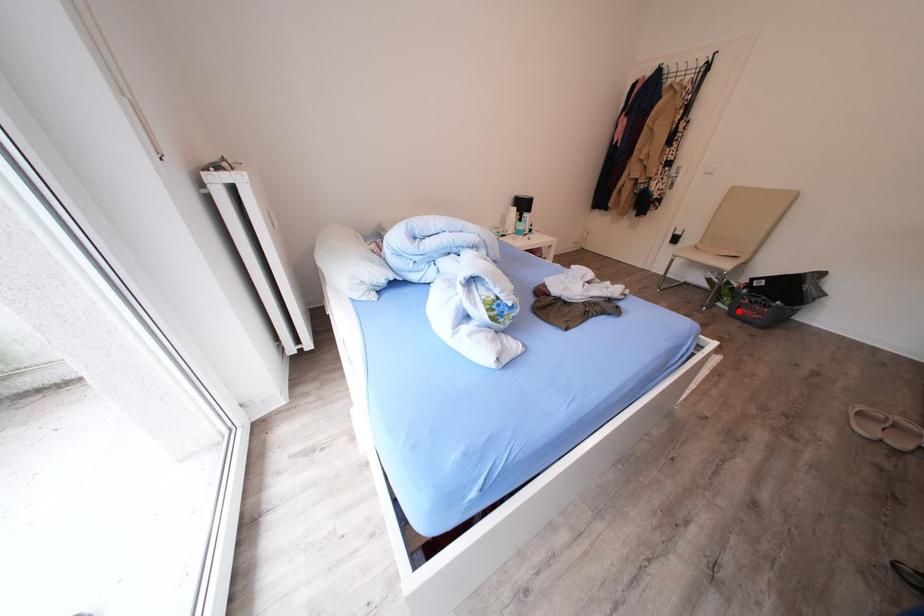
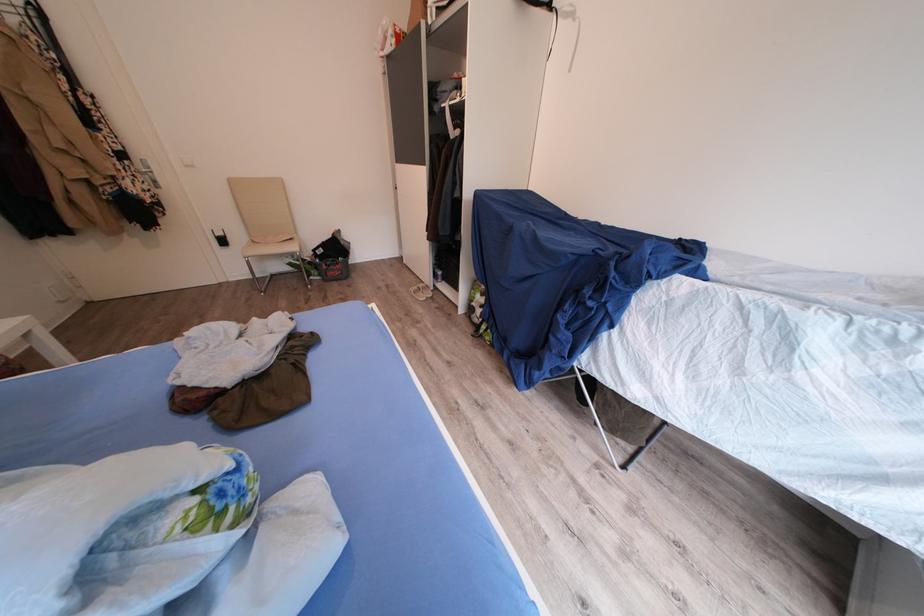
Question: A red point is marked in image1. In image2, is the corresponding 3D point closer to the camera or farther? Reply with the corresponding letter.

Choices:
 (A) The corresponding 3D point is closer.
 (B) The corresponding 3D point is farther.

Answer: (A)